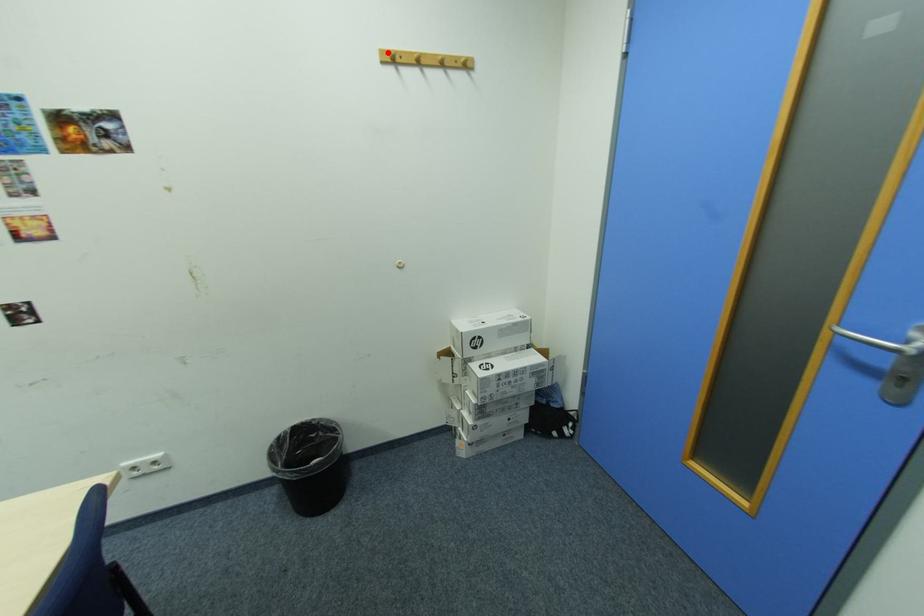
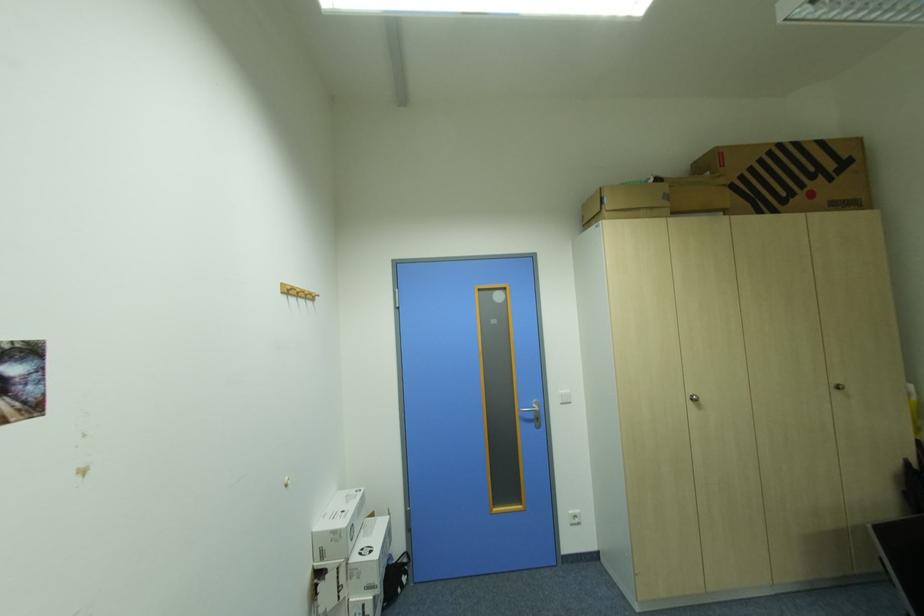
Find the pixel in the second image that matches the highlighted location in the first image.

(293, 284)